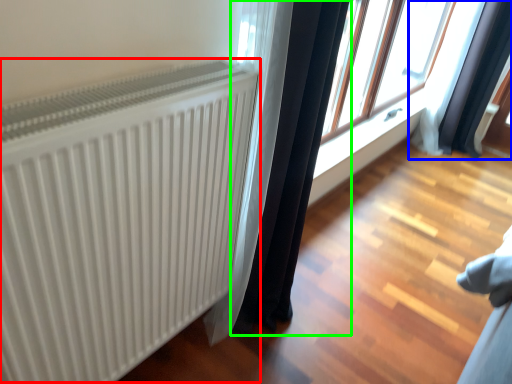
Question: Which object is positioned farthest from radiator (highlighted by a red box)? Select from curtain (highlighted by a blue box) and curtain (highlighted by a green box).

Choices:
 (A) curtain
 (B) curtain

Answer: (A)